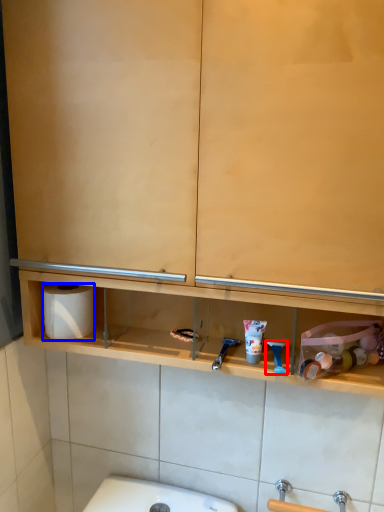
Question: Which of the following is the farthest to the observer, shower (highlighted by a red box) or toilet paper (highlighted by a blue box)?

Choices:
 (A) shower
 (B) toilet paper

Answer: (B)